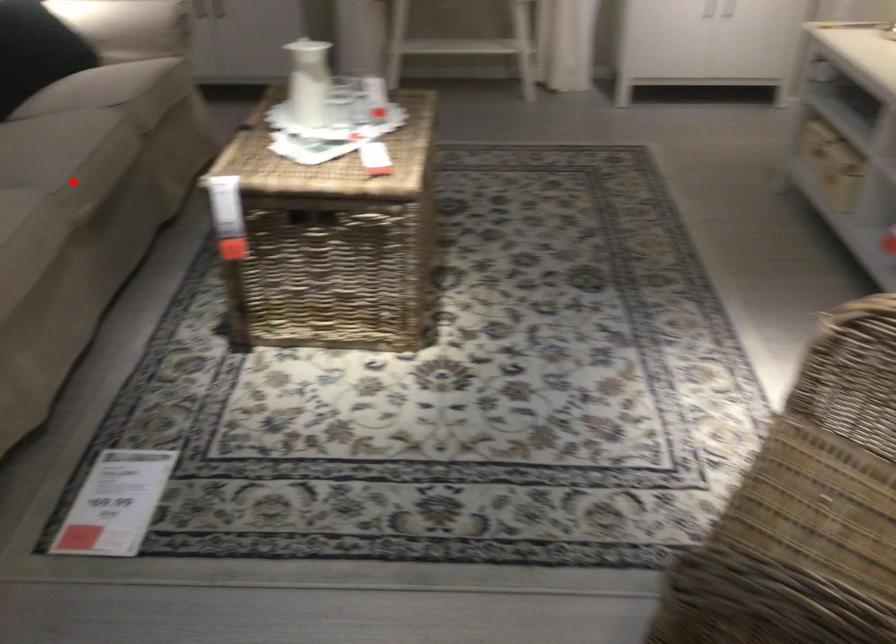
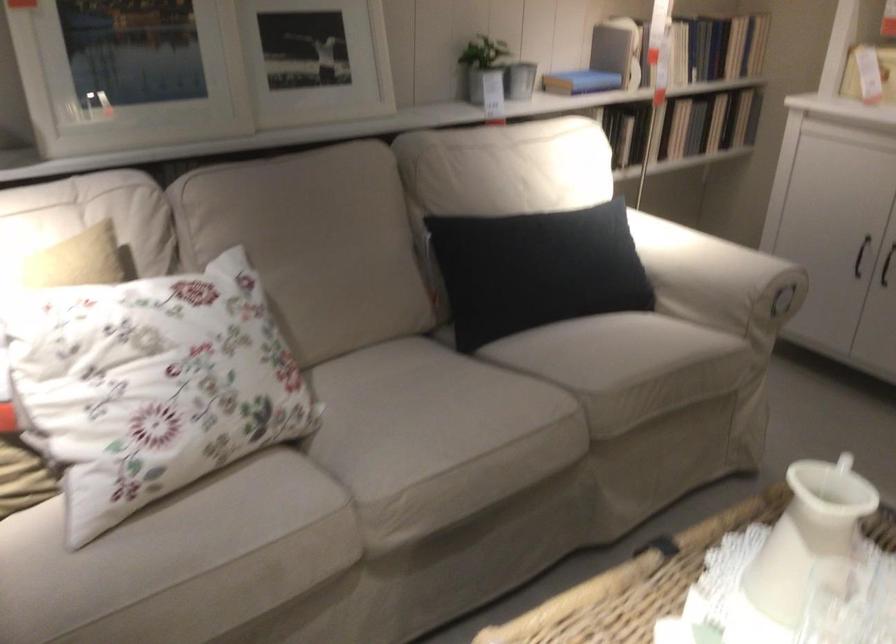
Question: A red point is marked in image1. In image2, is the corresponding 3D point closer to the camera or farther? Reply with the corresponding letter.

Choices:
 (A) The corresponding 3D point is closer.
 (B) The corresponding 3D point is farther.

Answer: (A)